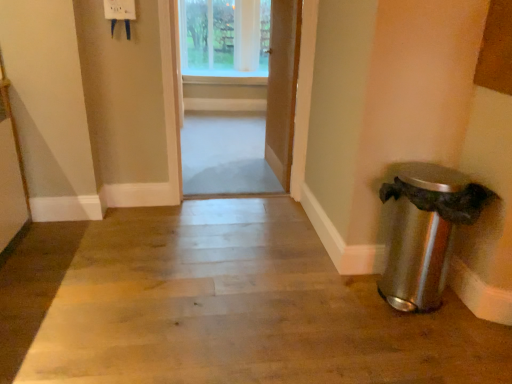
Where is `vacant space behind wooden door at center, the first door when ordered from left to right`? This screenshot has height=384, width=512. vacant space behind wooden door at center, the first door when ordered from left to right is located at coordinates (229, 172).